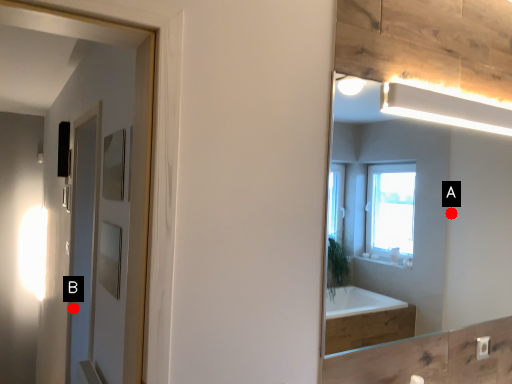
Question: Two points are circled on the image, labeled by A and B beside each circle. Among these points, which one is nearest to the camera?

Choices:
 (A) A is closer
 (B) B is closer

Answer: (B)